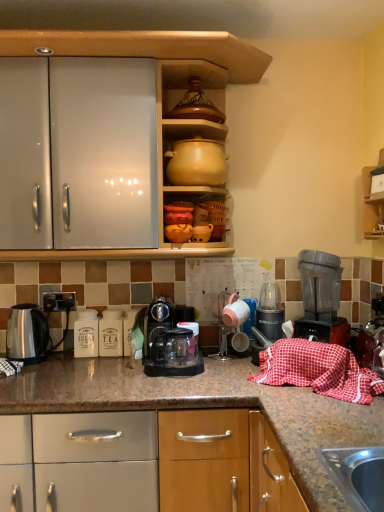
Question: In terms of width, does transparent plastic coffee maker at center, the second kitchen appliance when ordered from right to left, look wider or thinner when compared to black plastic electric outlet at lower left?

Choices:
 (A) wide
 (B) thin

Answer: (A)

Question: Considering the positions of transparent plastic coffee maker at center, the 2th kitchen appliance in the left-to-right sequence, and black plastic electric outlet at lower left in the image, is transparent plastic coffee maker at center, the 2th kitchen appliance in the left-to-right sequence, taller or shorter than black plastic electric outlet at lower left?

Choices:
 (A) short
 (B) tall

Answer: (B)

Question: Estimate the real-world distances between objects in this image. Which object is closer to the transparent plastic blender at right?

Choices:
 (A) matte yellow clay pot at upper center
 (B) metallic plastic blender at center, which ranks as the 3th kitchen appliance in left-to-right order
 (C) black plastic electric outlet at lower left
 (D) red checkered cloth at lower right
 (E) transparent plastic coffee maker at center, the second kitchen appliance when ordered from right to left

Answer: (D)

Question: Estimate the real-world distances between objects in this image. Which object is closer to the transparent plastic blender at right?

Choices:
 (A) transparent plastic coffee maker at center, the second kitchen appliance when ordered from right to left
 (B) matte yellow clay pot at upper center
 (C) red checkered cloth at lower right
 (D) black plastic electric outlet at lower left
 (E) metallic plastic blender at center, which ranks as the 3th kitchen appliance in left-to-right order

Answer: (C)